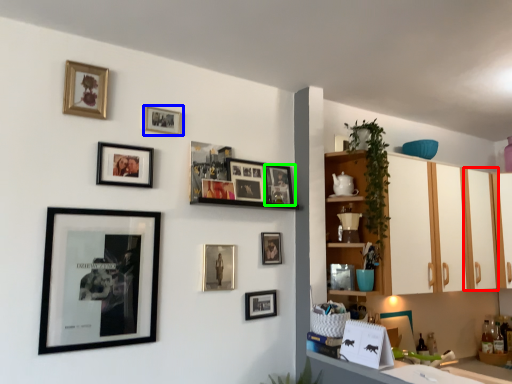
Question: Which object is the closest to the cabinetry (highlighted by a red box)? Choose among these: picture frame (highlighted by a blue box) or picture frame (highlighted by a green box).

Choices:
 (A) picture frame
 (B) picture frame

Answer: (B)